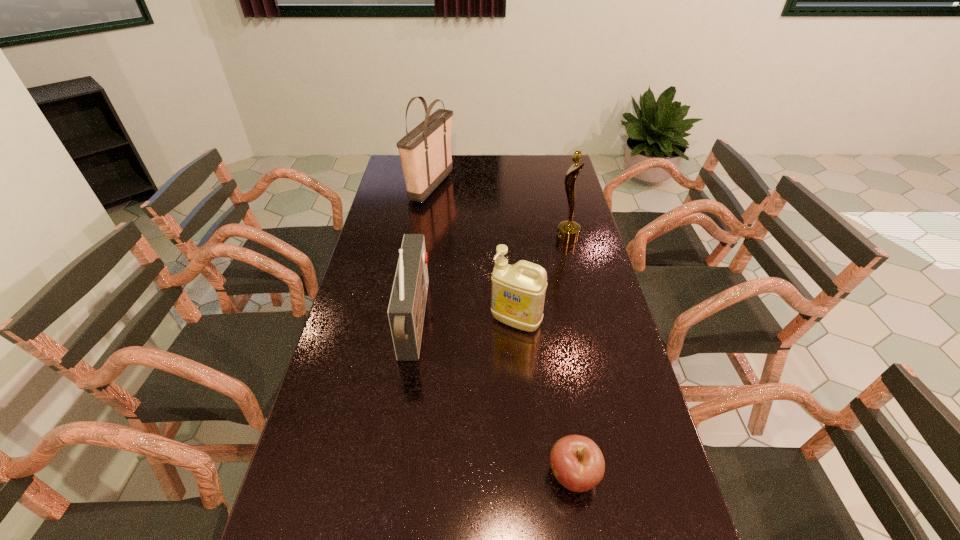
At what (x,y) coordinates should I click in order to perform the action: click on the farthest object. Please return your answer as a coordinate pair (x, y). The image size is (960, 540). Looking at the image, I should click on (425, 152).

Find the location of a particular element. This screenshot has height=540, width=960. the second farthest object is located at coordinates (568, 232).

I want to click on award, so click(568, 232).

At what (x,y) coordinates should I click in order to perform the action: click on radio receiver. Please return your answer as a coordinate pair (x, y). The width and height of the screenshot is (960, 540). Looking at the image, I should click on (406, 309).

What are the coordinates of `detergent` in the screenshot? It's located at (518, 291).

Find the location of a particular element. apple is located at coordinates (577, 462).

Where is `the nearest object`? the nearest object is located at coordinates (577, 462).

This screenshot has width=960, height=540. I want to click on vacant area situated on the left of the farthest object, so click(x=397, y=186).

The width and height of the screenshot is (960, 540). In order to click on vacant space located 0.060m on the front-facing side of the second farthest object in this screenshot , I will do `click(540, 238)`.

Find the location of a particular element. vacant space situated on the front-facing side of the second farthest object is located at coordinates (479, 238).